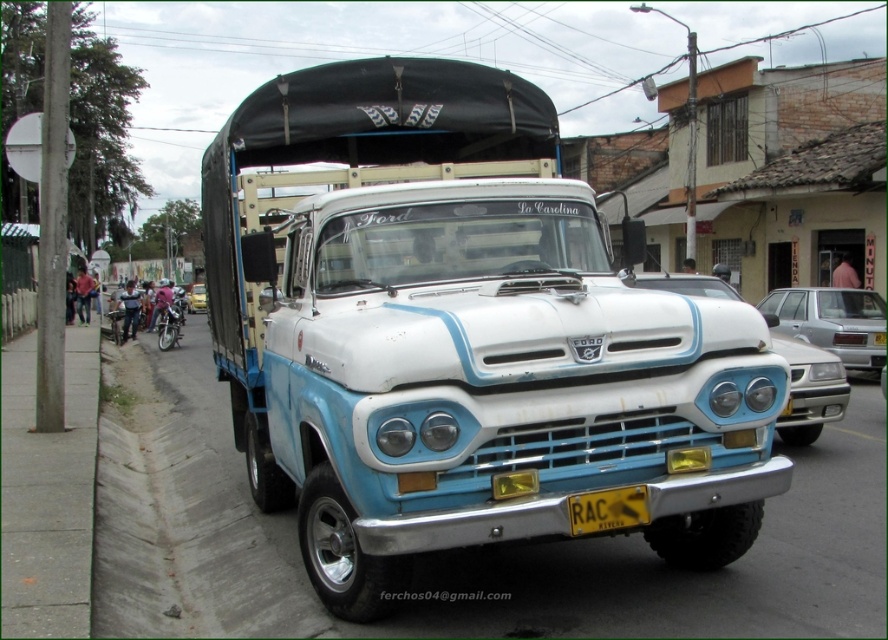
Does white glossy truck at center come in front of shiny silver motorcycle at left?

Yes, it is in front of shiny silver motorcycle at left.

This screenshot has height=640, width=888. What do you see at coordinates (809, 390) in the screenshot?
I see `white glossy truck at center` at bounding box center [809, 390].

Is point (826, 404) positioned after point (165, 333)?

That is False.

You are a GUI agent. You are given a task and a screenshot of the screen. Output one action in this format:
    pyautogui.click(x=<x>, y=<y>)
    Task: Click on the white glossy truck at center
    The height and width of the screenshot is (640, 888).
    Given the screenshot: What is the action you would take?
    pyautogui.click(x=809, y=390)

Is white glossy truck at center to the right of yellow matte license plate at center from the viewer's perspective?

Yes, white glossy truck at center is to the right of yellow matte license plate at center.

Is white glossy truck at center below yellow matte license plate at center?

No.

You are a GUI agent. You are given a task and a screenshot of the screen. Output one action in this format:
    pyautogui.click(x=<x>, y=<y>)
    Task: Click on the white glossy truck at center
    The image size is (888, 640).
    Given the screenshot: What is the action you would take?
    pyautogui.click(x=809, y=390)

This screenshot has width=888, height=640. What do you see at coordinates (809, 390) in the screenshot?
I see `white glossy truck at center` at bounding box center [809, 390].

Can you confirm if white glossy truck at center is bigger than silver metallic sedan at right?

Yes, white glossy truck at center is bigger than silver metallic sedan at right.

Find the location of a particular element. Image resolution: width=888 pixels, height=640 pixels. white glossy truck at center is located at coordinates (809, 390).

What are the coordinates of `white glossy truck at center` in the screenshot? It's located at (809, 390).